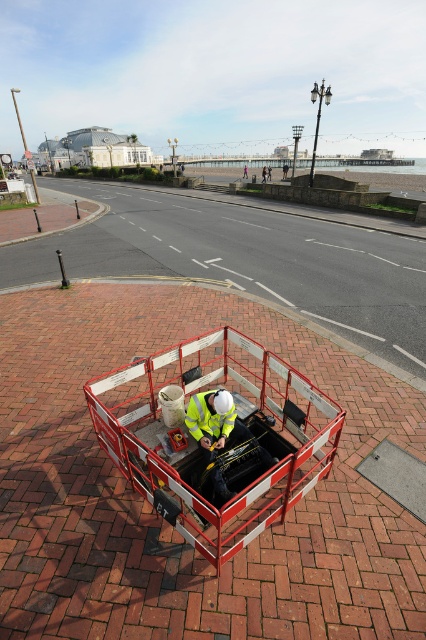
You are a delivery person who needs to place a package on top of either the reflective yellow vest at center or the metallic red cart at center. Which object can you place the package on without it falling off?

The reflective yellow vest at center is much taller than the metallic red cart at center, so placing the package on the reflective yellow vest at center would be more stable and less likely to fall off.